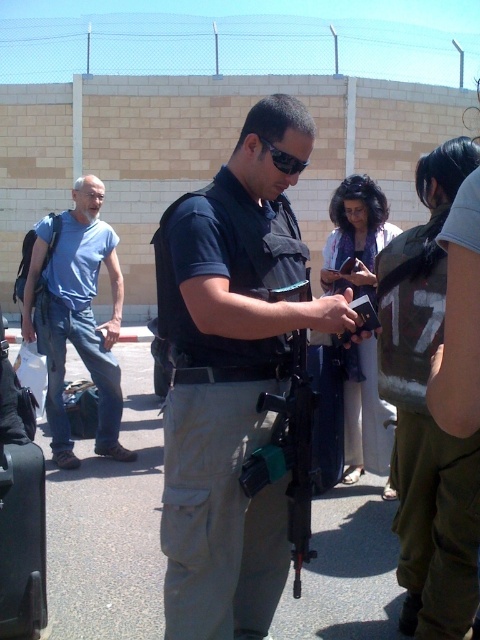
Question: Can you confirm if blue denim jeans at left is smaller than black plastic sunglasses at center?

Choices:
 (A) no
 (B) yes

Answer: (A)

Question: Which object appears closest to the camera in this image?

Choices:
 (A) black plastic gun at center
 (B) black hard suitcase at lower left
 (C) matte black vest at center

Answer: (C)

Question: Does matte black vest at center appear on the right side of black plastic gun at center?

Choices:
 (A) no
 (B) yes

Answer: (A)

Question: Which point is closer to the camera?

Choices:
 (A) black plastic sunglasses at center
 (B) blue denim jeans at left
 (C) black hard suitcase at lower left
 (D) matte black vest at center

Answer: (D)

Question: Is black plastic gun at center to the right of black plastic sunglasses at center from the viewer's perspective?

Choices:
 (A) no
 (B) yes

Answer: (B)

Question: Which object is the closest to the black plastic gun at center?

Choices:
 (A) blue denim jeans at left
 (B) matte black vest at center
 (C) black hard suitcase at lower left

Answer: (B)